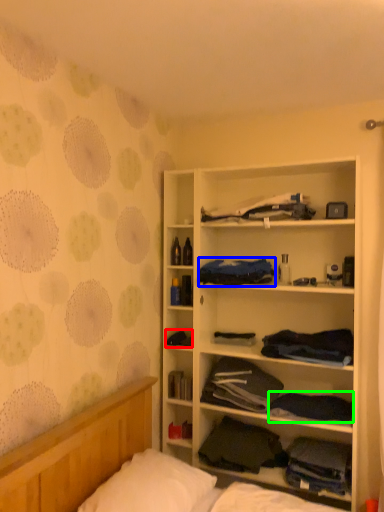
Question: Based on their relative distances, which object is farther from clothing (highlighted by a red box)? Choose from clothing (highlighted by a blue box) and clothing (highlighted by a green box).

Choices:
 (A) clothing
 (B) clothing

Answer: (B)